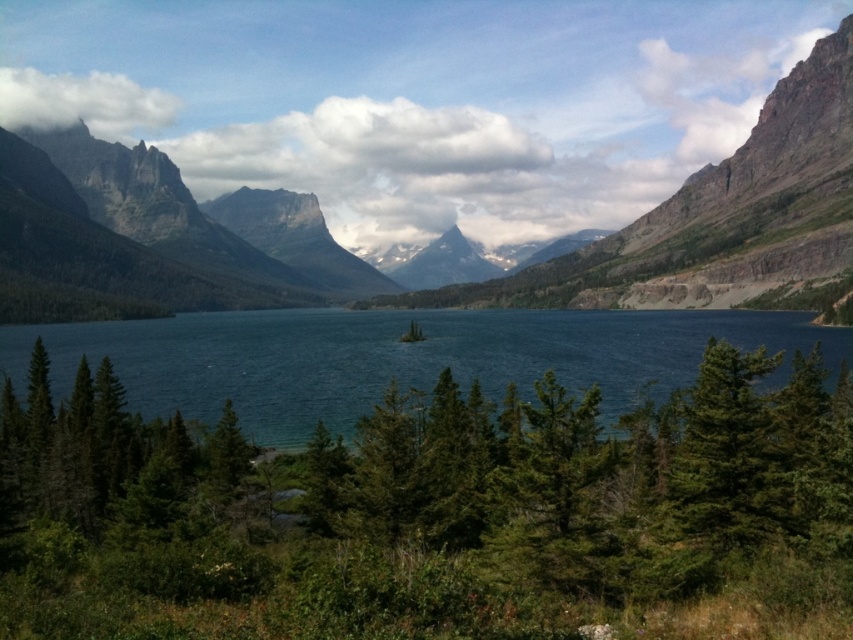
Question: Does green matte tree at center have a smaller size compared to blue water at center?

Choices:
 (A) no
 (B) yes

Answer: (B)

Question: Considering the real-world distances, which object is farthest from the rugged granite mountain at left?

Choices:
 (A) green matte tree at center
 (B) green matte tree at lower right

Answer: (B)

Question: Is green matte tree at center above blue water at center?

Choices:
 (A) yes
 (B) no

Answer: (B)

Question: Can you confirm if blue water at center is bigger than green matte tree at lower right?

Choices:
 (A) no
 (B) yes

Answer: (B)

Question: Among these objects, which one is farthest from the camera?

Choices:
 (A) rugged granite mountain at left
 (B) green matte tree at lower right
 (C) blue water at center
 (D) green matte tree at center

Answer: (A)

Question: Which object is the closest to the green matte tree at center?

Choices:
 (A) green matte tree at lower right
 (B) rugged granite mountain at left
 (C) blue water at center

Answer: (A)